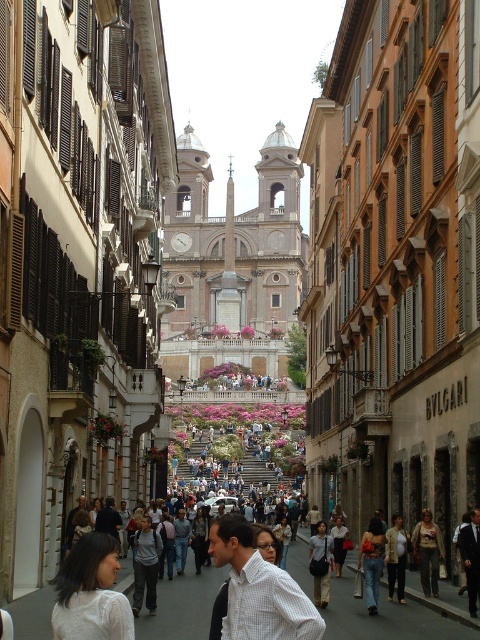
Is white cotton tank top at center thinner than light brown leather jacket at center?

Incorrect, white cotton tank top at center's width is not less than light brown leather jacket at center's.

Between point (432, 548) and point (394, 580), which one is positioned behind?

The point (394, 580) is behind.

The height and width of the screenshot is (640, 480). What are the coordinates of `white cotton tank top at center` in the screenshot? It's located at (428, 552).

Does light gray shirt at center have a smaller size compared to light blue denim jeans at center?

Indeed, light gray shirt at center has a smaller size compared to light blue denim jeans at center.

Is light gray shirt at center thinner than light blue denim jeans at center?

Correct, light gray shirt at center's width is less than light blue denim jeans at center's.

Identify the location of light gray shirt at center. This screenshot has height=640, width=480. (145, 564).

Who is more forward, (x=111, y=614) or (x=315, y=556)?

Positioned in front is point (x=111, y=614).

Between white matte shirt at lower left and light blue denim jeans at center, which one is positioned lower?

light blue denim jeans at center is lower down.

Does point (81, 566) lie in front of point (311, 570)?

Yes, it is.

The width and height of the screenshot is (480, 640). Identify the location of white matte shirt at lower left. (91, 593).